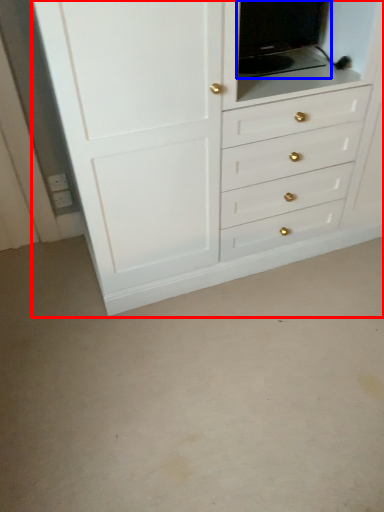
Question: Which object is closer to the camera taking this photo, chest of drawers (highlighted by a red box) or medicine cabinet (highlighted by a blue box)?

Choices:
 (A) chest of drawers
 (B) medicine cabinet

Answer: (A)